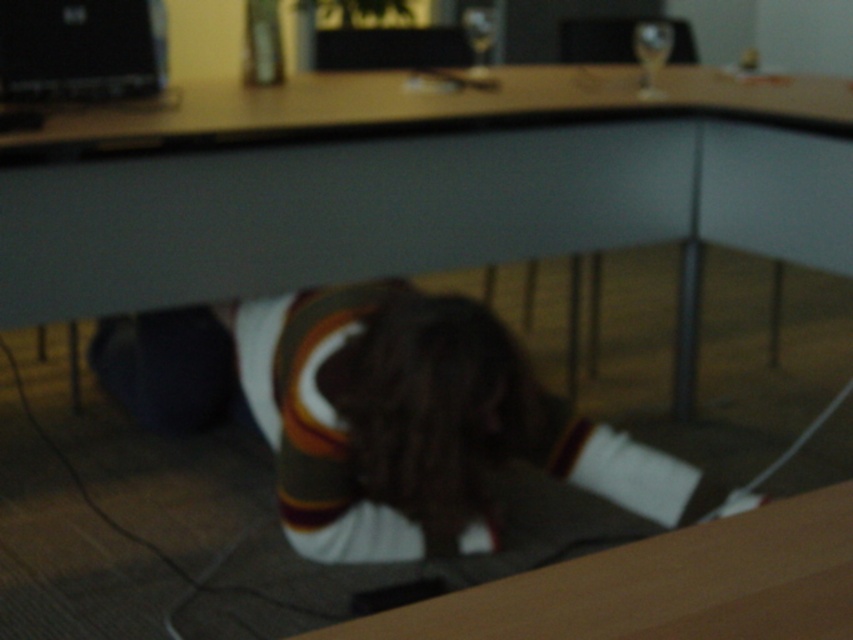
Locate an element on the screen. The width and height of the screenshot is (853, 640). smooth wood computer desk at center is located at coordinates (416, 184).

Can you confirm if smooth wood computer desk at center is thinner than black matte laptop at upper left?

No, smooth wood computer desk at center is not thinner than black matte laptop at upper left.

Where is `smooth wood computer desk at center`? smooth wood computer desk at center is located at coordinates (416, 184).

Who is positioned more to the left, smooth wood computer desk at center or brown jersey at center?

brown jersey at center is more to the left.

Who is more forward, (700, 131) or (338, 504)?

Point (338, 504) is more forward.

Where is `smooth wood computer desk at center`? The width and height of the screenshot is (853, 640). smooth wood computer desk at center is located at coordinates (416, 184).

How far apart are brown jersey at center and black matte laptop at upper left?

brown jersey at center and black matte laptop at upper left are 36.21 inches apart.

Is brown jersey at center in front of black matte laptop at upper left?

Yes, brown jersey at center is closer to the viewer.

The height and width of the screenshot is (640, 853). Describe the element at coordinates (415, 420) in the screenshot. I see `brown jersey at center` at that location.

Image resolution: width=853 pixels, height=640 pixels. I want to click on brown jersey at center, so click(x=415, y=420).